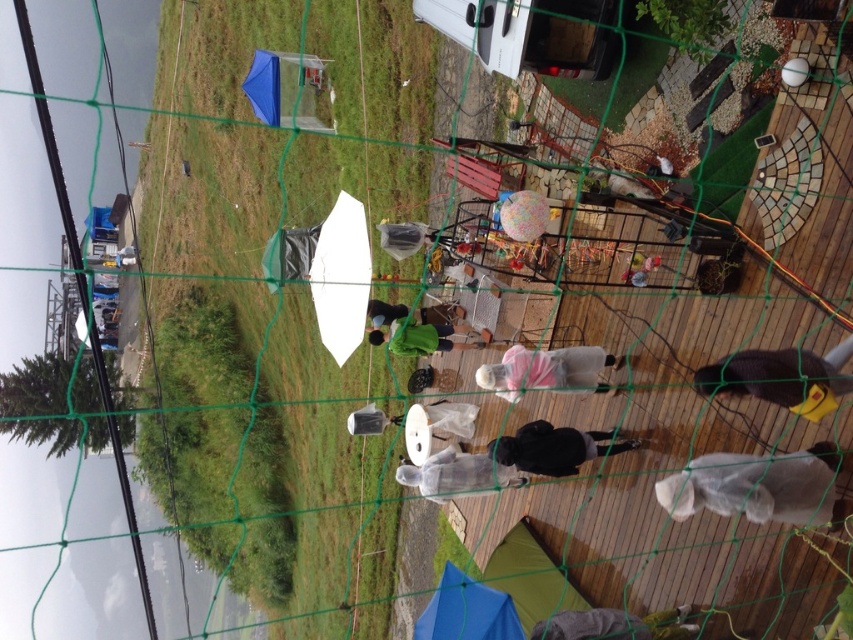
Question: Does clear plastic bag at lower right have a smaller size compared to black matte jacket at center?

Choices:
 (A) no
 (B) yes

Answer: (A)

Question: Can you confirm if green grass at left is positioned to the right of pink matte raincoat at center?

Choices:
 (A) no
 (B) yes

Answer: (A)

Question: In this image, where is dark gray fabric jacket at center located relative to light blue fabric at center?

Choices:
 (A) below
 (B) above

Answer: (A)

Question: Which object is positioned closest to the light blue fabric at center?

Choices:
 (A) green grass at left
 (B) green matte jacket at center
 (C) blue translucent umbrella at lower center
 (D) pink matte raincoat at center

Answer: (D)

Question: Estimate the real-world distances between objects in this image. Which object is farther from the clear plastic bag at center?

Choices:
 (A) translucent plastic umbrella at center
 (B) dark gray fabric at lower right
 (C) clear plastic bag at lower right

Answer: (B)

Question: Which point appears farthest from the camera in this image?

Choices:
 (A) (805, 365)
 (B) (622, 273)

Answer: (B)